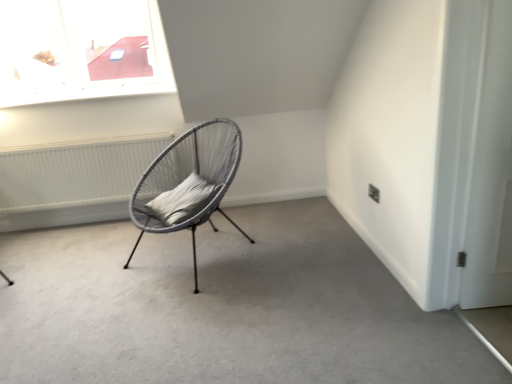
The width and height of the screenshot is (512, 384). Find the location of `vacant space in front of matte grey wicker chair at center`. vacant space in front of matte grey wicker chair at center is located at coordinates (184, 311).